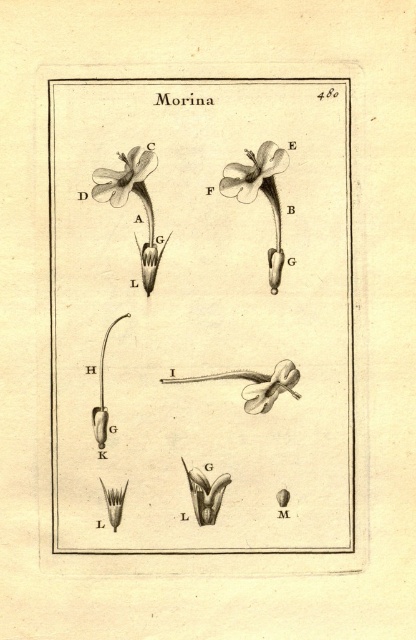
In the botanical illustration labeled Morina, there are two white flowers depicted. The first is a white paper flower at upper center and the second is a matte white flower at upper left. Which of these two flowers is positioned higher on the page?

The white paper flower at upper center is positioned higher on the page than the matte white flower at upper left.

You are an artist trying to label the matte white flower at upper left with the black ink pen at upper center. Given that the pen is 8.46 inches away from the flower, can you comfortably reach it without moving your hand?

The black ink pen at upper center is 8.46 inches away from the matte white flower at upper left, so it is possible to reach the flower with the pen without moving your hand, assuming standard reach capabilities.